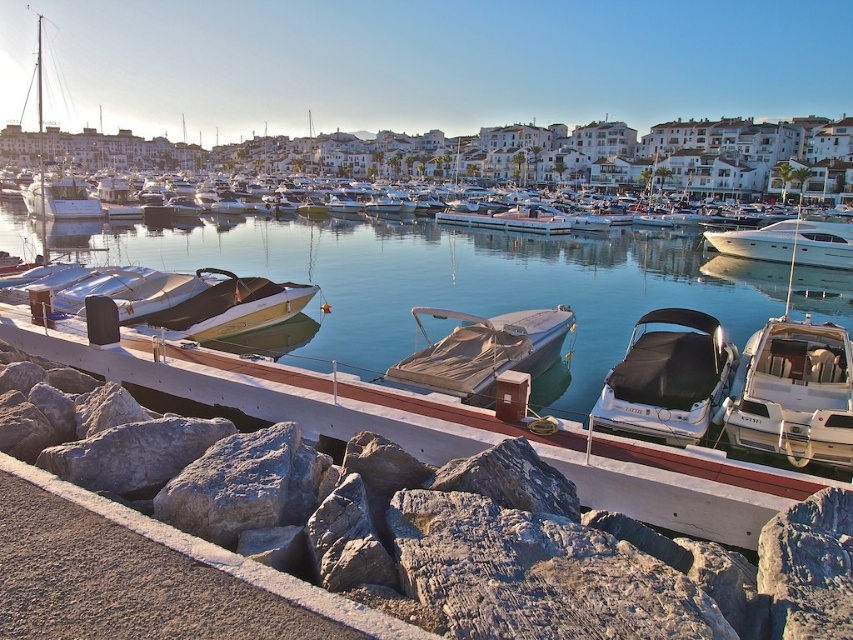
Does point (840, 467) come behind point (294, 298)?

That is False.

Can you confirm if white glossy motorboat at right is positioned above matte brown boat at center?

Incorrect, white glossy motorboat at right is not positioned above matte brown boat at center.

Who is more distant from viewer, (804, 400) or (219, 301)?

The point (219, 301) is behind.

Locate an element on the screen. This screenshot has width=853, height=640. white glossy motorboat at right is located at coordinates pos(793,394).

Does white glossy motorboat at right have a lesser width compared to beige canvas boat at center?

Correct, white glossy motorboat at right's width is less than beige canvas boat at center's.

Which is in front, point (761, 380) or point (418, 365)?

Point (761, 380) is in front.

This screenshot has height=640, width=853. What are the coordinates of `white glossy motorboat at right` in the screenshot? It's located at (793, 394).

Between white concrete dock at center and black tarpaulin boat at center, which one is positioned lower?

black tarpaulin boat at center is lower down.

Measure the distance between point (x=798, y=476) and camera.

The distance of point (x=798, y=476) from camera is 39.74 feet.

Find the location of a particular element. This screenshot has width=853, height=640. white concrete dock at center is located at coordinates (437, 428).